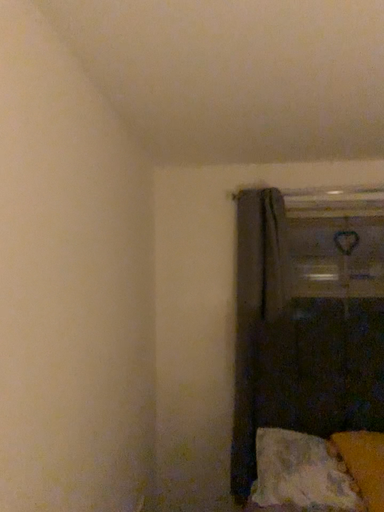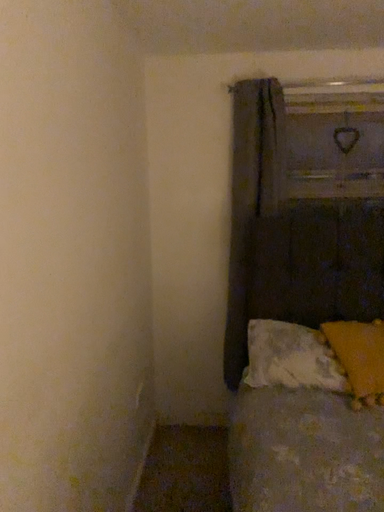
Question: Which way did the camera rotate in the video?

Choices:
 (A) rotated downward
 (B) rotated upward

Answer: (A)